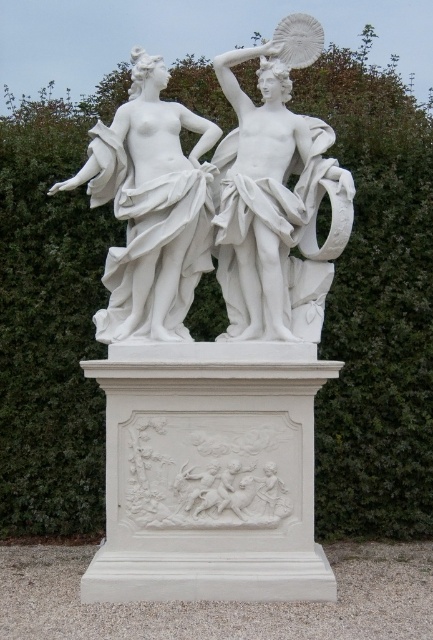
Is white marble statue at center bigger than white marble statue at left?

No.

Does white marble statue at center have a greater height compared to white marble statue at left?

Yes, white marble statue at center is taller than white marble statue at left.

What do you see at coordinates (277, 196) in the screenshot? I see `white marble statue at center` at bounding box center [277, 196].

Where is `white marble statue at center`? Image resolution: width=433 pixels, height=640 pixels. white marble statue at center is located at coordinates (277, 196).